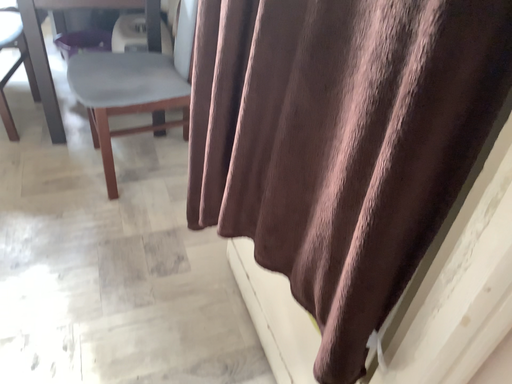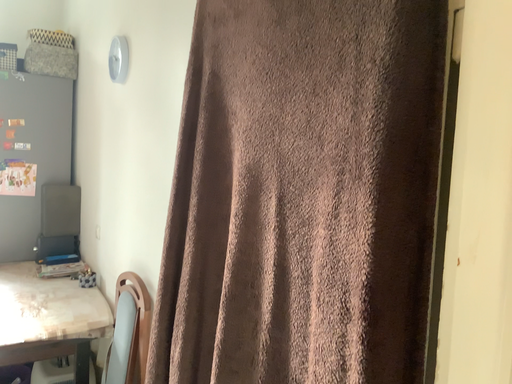
Question: How did the camera likely rotate when shooting the video?

Choices:
 (A) rotated left
 (B) rotated right

Answer: (B)